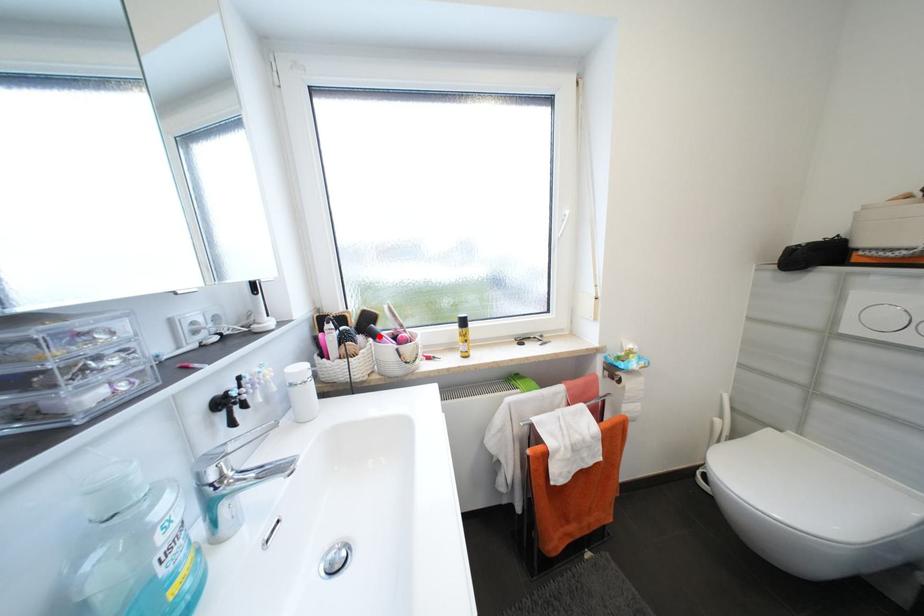
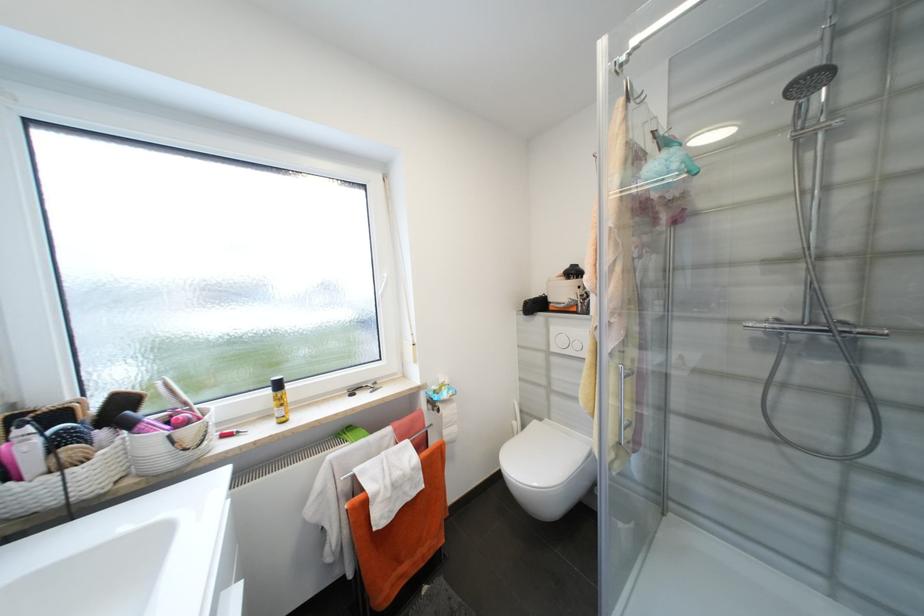
Question: I am providing you with two images of the same scene from different viewpoints. A red point is marked on the first image. Is the red point's position out of view in image 2?

Choices:
 (A) Yes
 (B) No

Answer: (B)